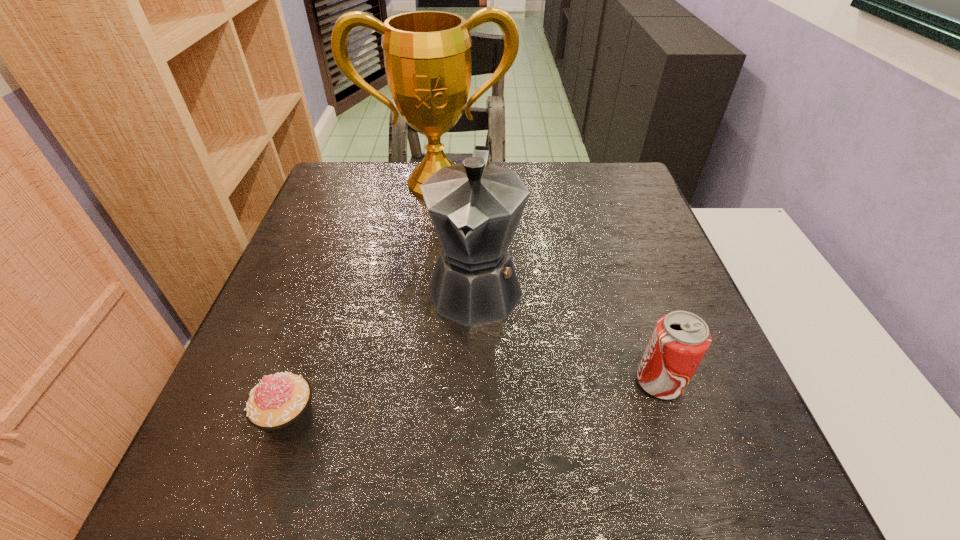
Where is `object at the right edge`? object at the right edge is located at coordinates (680, 339).

Locate an element on the screen. This screenshot has height=540, width=960. object positioned at the far left corner is located at coordinates [427, 56].

The height and width of the screenshot is (540, 960). I want to click on object that is at the near left corner, so click(x=280, y=405).

Find the location of a particular element. The height and width of the screenshot is (540, 960). object at the near right corner is located at coordinates (680, 339).

In the image, there is a desktop. Where is `free space at the far edge`? The width and height of the screenshot is (960, 540). free space at the far edge is located at coordinates (393, 205).

Identify the location of vacant space at the near edge of the desktop. (425, 397).

This screenshot has width=960, height=540. Find the location of `vacant area at the left edge`. vacant area at the left edge is located at coordinates (271, 339).

Locate an element on the screen. Image resolution: width=960 pixels, height=540 pixels. free region at the right edge is located at coordinates (660, 286).

At what (x,y) coordinates should I click in order to perform the action: click on blank area at the far left corner. Please return your answer as a coordinate pair (x, y). The image size is (960, 540). Looking at the image, I should click on (357, 206).

The width and height of the screenshot is (960, 540). I want to click on vacant area at the far right corner, so click(603, 208).